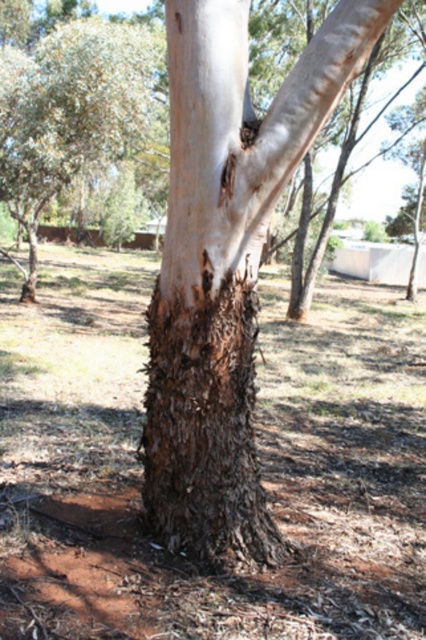
Between brown rough bark at center and rough bark tree at center, which one is positioned lower?

brown rough bark at center

Find the location of a particular element. brown rough bark at center is located at coordinates (201, 376).

Between point (236, 282) and point (103, 32), which one is positioned in front?

Positioned in front is point (236, 282).

Where is `brown rough bark at center`? The width and height of the screenshot is (426, 640). brown rough bark at center is located at coordinates (201, 376).